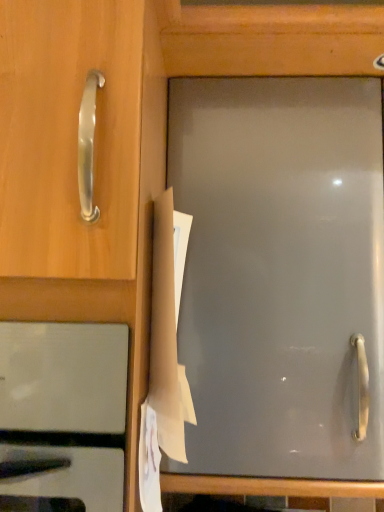
Question: Is brown paper at center in front of or behind stainless steel oven at lower left in the image?

Choices:
 (A) behind
 (B) front

Answer: (A)

Question: From a real-world perspective, is brown paper at center positioned above or below stainless steel oven at lower left?

Choices:
 (A) below
 (B) above

Answer: (B)

Question: Is brown paper at center wider or thinner than stainless steel oven at lower left?

Choices:
 (A) thin
 (B) wide

Answer: (A)

Question: Is stainless steel oven at lower left wider or thinner than brown paper at center?

Choices:
 (A) wide
 (B) thin

Answer: (A)

Question: From a real-world perspective, relative to brown paper at center, is stainless steel oven at lower left vertically above or below?

Choices:
 (A) below
 (B) above

Answer: (A)

Question: Is stainless steel oven at lower left to the left or to the right of brown paper at center in the image?

Choices:
 (A) right
 (B) left

Answer: (B)

Question: Is stainless steel oven at lower left taller or shorter than brown paper at center?

Choices:
 (A) tall
 (B) short

Answer: (A)